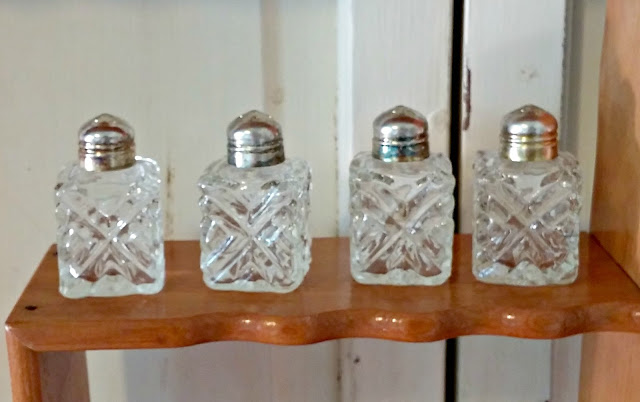
Locate an element on the screen. wall is located at coordinates (224, 75).